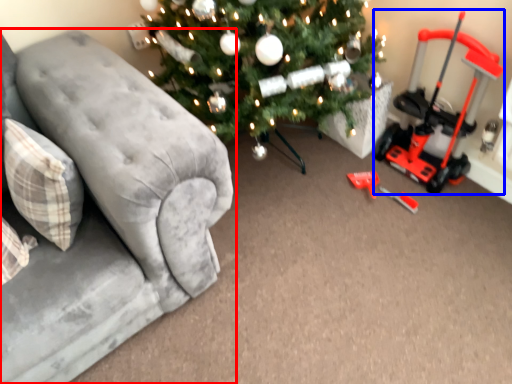
Question: Which of the following is the farthest to the observer, studio couch (highlighted by a red box) or equipment (highlighted by a blue box)?

Choices:
 (A) studio couch
 (B) equipment

Answer: (B)